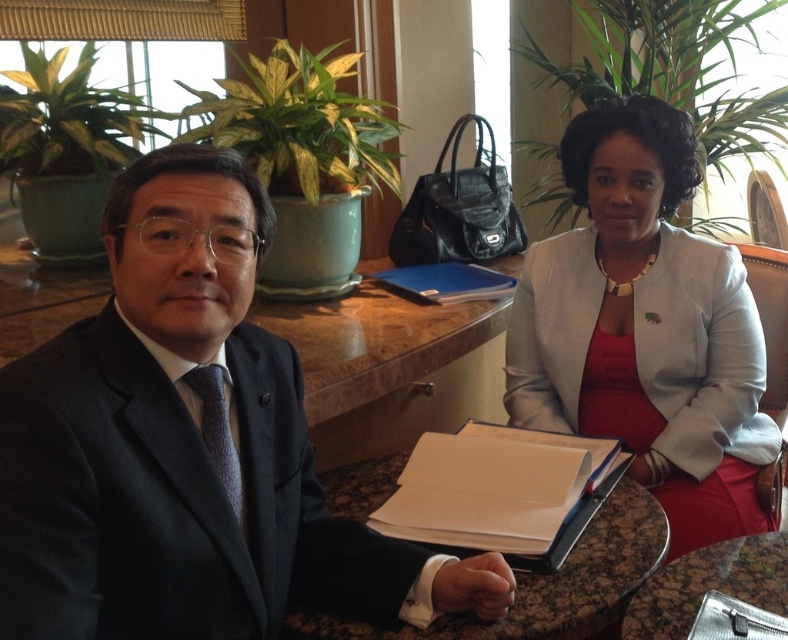
You are an interior designer observing the scene. You need to place a decorative item between the white matte blazer at center and the dark brown textured tie at left. Based on their positions, which object should be closer to the top of the image?

The white matte blazer at center is above the dark brown textured tie at left, so the decorative item should be placed closer to the white matte blazer at center to maintain their vertical positions.

You are a tailor measuring garments for alterations. You need to determine if the white matte blazer at center can be placed on the brown marble table at center without hanging over the edges. Can it fit based on their sizes?

The white matte blazer at center is taller than the brown marble table at center, so it will hang over the edges when placed on the table.